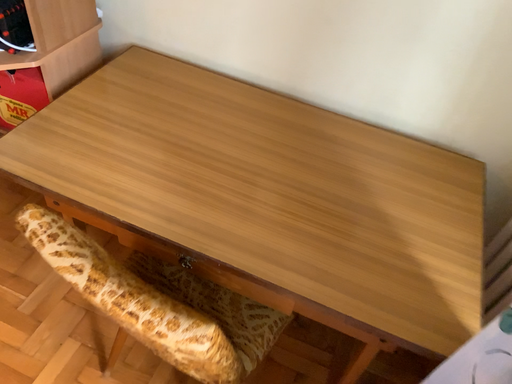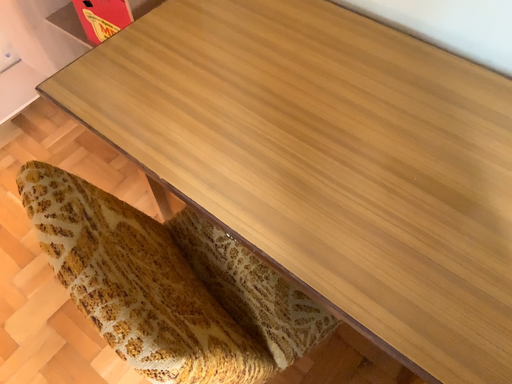
Question: How did the camera likely rotate when shooting the video?

Choices:
 (A) rotated right
 (B) rotated left

Answer: (B)